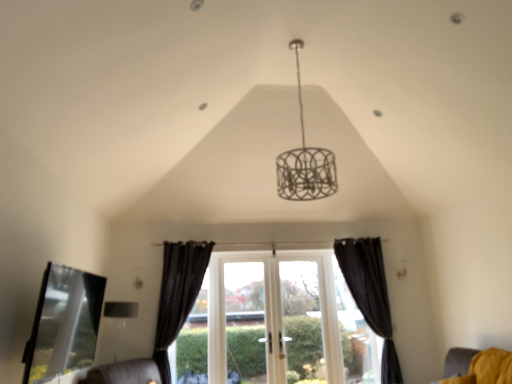
The image size is (512, 384). Identify the location of yellow fabric cushion at lower right. (478, 366).

The width and height of the screenshot is (512, 384). Describe the element at coordinates (120, 316) in the screenshot. I see `matte silver lampshade at lower left` at that location.

Find the location of a particular element. white wood window at center is located at coordinates (276, 320).

This screenshot has height=384, width=512. What do you see at coordinates (370, 295) in the screenshot? I see `black matte curtain at right, arranged as the 2th curtain when viewed from the left` at bounding box center [370, 295].

What do you see at coordinates (178, 294) in the screenshot? I see `black velvet curtain at center, the 2th curtain positioned from the right` at bounding box center [178, 294].

Where is `yellow fabric cushion at lower right`? yellow fabric cushion at lower right is located at coordinates (478, 366).

What's the angular difference between black matte curtain at right, arranged as the 2th curtain when viewed from the left, and white wood window at center's facing directions?

0.728 degrees separate the facing orientations of black matte curtain at right, arranged as the 2th curtain when viewed from the left, and white wood window at center.

Does black matte curtain at right, which is the 1th curtain from right to left, have a greater height compared to white wood window at center?

Yes, black matte curtain at right, which is the 1th curtain from right to left, is taller than white wood window at center.

Is black matte curtain at right, arranged as the 2th curtain when viewed from the left, situated inside white wood window at center or outside?

black matte curtain at right, arranged as the 2th curtain when viewed from the left, is located beyond the bounds of white wood window at center.

Does point (389, 350) come behind point (328, 318)?

No, it is not.

Is white wood window at center looking in the opposite direction of black velvet curtain at center, placed as the 1th curtain when sorted from left to right?

white wood window at center does not have its back to black velvet curtain at center, placed as the 1th curtain when sorted from left to right.

From the image's perspective, which is above, white wood window at center or black velvet curtain at center, the 2th curtain positioned from the right?

black velvet curtain at center, the 2th curtain positioned from the right.

Which is in front, point (234, 349) or point (175, 253)?

Point (175, 253)

At what (x,y) coordinates should I click in order to perform the action: click on curtain that is the 2nd one above the white wood window at center (from a real-world perspective). Please return your answer as a coordinate pair (x, y). Looking at the image, I should click on (178, 294).

Does white wood window at center touch black matte curtain at right, which is the 1th curtain from right to left?

No.

How much distance is there between white wood window at center and black matte curtain at right, arranged as the 2th curtain when viewed from the left?

white wood window at center is 36.19 inches away from black matte curtain at right, arranged as the 2th curtain when viewed from the left.

Does white wood window at center have a smaller size compared to black matte curtain at right, arranged as the 2th curtain when viewed from the left?

Yes.

Is matte silver lampshade at lower left surrounded by transparent glass bay window at lower left?

No, transparent glass bay window at lower left does not contain matte silver lampshade at lower left.

Based on the photo, can you confirm if transparent glass bay window at lower left is thinner than matte silver lampshade at lower left?

Yes.

From the image's perspective, is transparent glass bay window at lower left positioned above or below matte silver lampshade at lower left?

From the image's perspective, transparent glass bay window at lower left appears above matte silver lampshade at lower left.

Find the location of a particular element. lamp lying below the transparent glass bay window at lower left (from the image's perspective) is located at coordinates (120, 316).

In terms of size, does black matte curtain at right, which is the 1th curtain from right to left, appear bigger or smaller than matte silver lampshade at lower left?

Considering their sizes, black matte curtain at right, which is the 1th curtain from right to left, takes up more space than matte silver lampshade at lower left.

Is matte silver lampshade at lower left inside black matte curtain at right, which is the 1th curtain from right to left?

No, black matte curtain at right, which is the 1th curtain from right to left, does not contain matte silver lampshade at lower left.

Is black matte curtain at right, arranged as the 2th curtain when viewed from the left, wider or thinner than matte silver lampshade at lower left?

Considering their sizes, black matte curtain at right, arranged as the 2th curtain when viewed from the left, looks slimmer than matte silver lampshade at lower left.

Is black matte curtain at right, which is the 1th curtain from right to left, facing away from matte silver lampshade at lower left?

No.

Between matte silver lampshade at lower left and white glass door at center, which one appears on the left side from the viewer's perspective?

matte silver lampshade at lower left.

Is matte silver lampshade at lower left looking in the opposite direction of white glass door at center?

No, matte silver lampshade at lower left's orientation is not away from white glass door at center.

Which of these two, matte silver lampshade at lower left or white glass door at center, is bigger?

With larger size is white glass door at center.

Between matte silver lampshade at lower left and white glass door at center, which one has less height?

matte silver lampshade at lower left.

Between matte silver lampshade at lower left and white wood window at center, which one is positioned in front?

Positioned in front is matte silver lampshade at lower left.

Is matte silver lampshade at lower left looking in the opposite direction of white wood window at center?

No, matte silver lampshade at lower left is not facing the opposite direction of white wood window at center.

From the image's perspective, which is below, matte silver lampshade at lower left or white wood window at center?

white wood window at center, from the image's perspective.

How much distance is there between matte silver lampshade at lower left and white wood window at center?

matte silver lampshade at lower left and white wood window at center are 6.75 feet apart.

From the image's perspective, starting from the white wood window at center, which curtain is the 1st one above? Please provide its 2D coordinates.

[(370, 295)]

This screenshot has width=512, height=384. I want to click on window on the right of black velvet curtain at center, the 2th curtain positioned from the right, so click(x=276, y=320).

Looking at the image, which one is located closer to matte silver lampshade at lower left, transparent glass bay window at lower left or white wood window at center?

transparent glass bay window at lower left.

Looking at this image, from the image, which object appears to be nearer to black matte curtain at right, arranged as the 2th curtain when viewed from the left, white glass screen door at center or yellow fabric cushion at lower right?

white glass screen door at center is positioned closer to the anchor black matte curtain at right, arranged as the 2th curtain when viewed from the left.

Based on their spatial positions, is white glass screen door at center or yellow fabric cushion at lower right closer to black velvet curtain at center, placed as the 1th curtain when sorted from left to right?

white glass screen door at center.

Looking at the image, which one is located further to white glass door at center, yellow fabric cushion at lower right or matte silver lampshade at lower left?

yellow fabric cushion at lower right lies further to white glass door at center than the other object.

From the image, which object appears to be farther from yellow fabric cushion at lower right, matte silver lampshade at lower left or transparent glass bay window at lower left?

The object further to yellow fabric cushion at lower right is matte silver lampshade at lower left.

From the image, which object appears to be nearer to matte silver lampshade at lower left, black velvet curtain at center, the 2th curtain positioned from the right, or transparent glass bay window at lower left?

black velvet curtain at center, the 2th curtain positioned from the right, is positioned closer to the anchor matte silver lampshade at lower left.

Which object lies nearer to the anchor point white wood window at center, white glass screen door at center or white glass door at center?

Among the two, white glass screen door at center is located nearer to white wood window at center.

Based on their spatial positions, is white glass screen door at center or black matte curtain at right, which is the 1th curtain from right to left, closer to white wood window at center?

The object closer to white wood window at center is white glass screen door at center.

The height and width of the screenshot is (384, 512). I want to click on screen door situated between white glass door at center and black matte curtain at right, arranged as the 2th curtain when viewed from the left, from left to right, so click(x=302, y=321).

Locate an element on the screen. Image resolution: width=512 pixels, height=384 pixels. window between yellow fabric cushion at lower right and white glass screen door at center from front to back is located at coordinates (276, 320).

This screenshot has height=384, width=512. In order to click on curtain between white glass door at center and yellow fabric cushion at lower right from left to right in this screenshot , I will do pos(370,295).

Image resolution: width=512 pixels, height=384 pixels. Identify the location of window frame between matte silver lampshade at lower left and black matte curtain at right, which is the 1th curtain from right to left, from left to right. (245, 321).